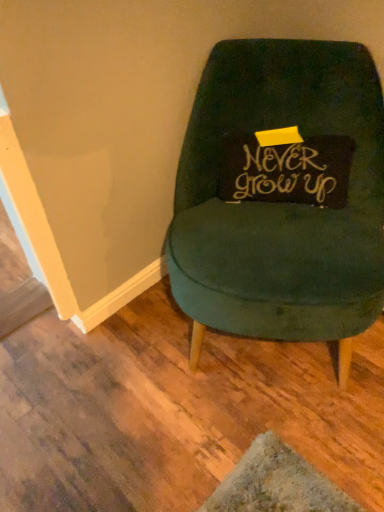
You are a GUI agent. You are given a task and a screenshot of the screen. Output one action in this format:
    pyautogui.click(x=<x>, y=<y>)
    Task: Click on the gold calligraphy pillow at center
    
    Given the screenshot: What is the action you would take?
    pyautogui.click(x=285, y=170)

The width and height of the screenshot is (384, 512). Describe the element at coordinates (285, 170) in the screenshot. I see `gold calligraphy pillow at center` at that location.

Image resolution: width=384 pixels, height=512 pixels. What do you see at coordinates (282, 195) in the screenshot? I see `velvet green chair at center` at bounding box center [282, 195].

Where is `velvet green chair at center`? Image resolution: width=384 pixels, height=512 pixels. velvet green chair at center is located at coordinates (282, 195).

Find the location of a particular element. This screenshot has width=384, height=512. gold calligraphy pillow at center is located at coordinates (285, 170).

Can you confirm if gold calligraphy pillow at center is positioned to the right of velvet green chair at center?

Correct, you'll find gold calligraphy pillow at center to the right of velvet green chair at center.

Does gold calligraphy pillow at center come behind velvet green chair at center?

Yes, gold calligraphy pillow at center is further from the camera.

Which is closer to the camera, (250, 176) or (359, 278)?

Point (250, 176) is positioned farther from the camera compared to point (359, 278).

From the image's perspective, which is above, gold calligraphy pillow at center or velvet green chair at center?

gold calligraphy pillow at center appears higher in the image.

From a real-world perspective, is gold calligraphy pillow at center physically located above or below velvet green chair at center?

gold calligraphy pillow at center is situated higher than velvet green chair at center in the real world.

Which of these two, gold calligraphy pillow at center or velvet green chair at center, is wider?

Wider between the two is velvet green chair at center.

Which of these two, gold calligraphy pillow at center or velvet green chair at center, stands taller?

velvet green chair at center is taller.

Looking at the image, does gold calligraphy pillow at center seem bigger or smaller compared to velvet green chair at center?

In the image, gold calligraphy pillow at center appears to be smaller than velvet green chair at center.

Is velvet green chair at center completely or partially inside gold calligraphy pillow at center?

No, velvet green chair at center is not a part of gold calligraphy pillow at center.

Is gold calligraphy pillow at center with velvet green chair at center?

gold calligraphy pillow at center is not next to velvet green chair at center, and they're not touching.

Is gold calligraphy pillow at center oriented away from velvet green chair at center?

That's right, gold calligraphy pillow at center is facing away from velvet green chair at center.

I want to click on chair in front of the gold calligraphy pillow at center, so click(282, 195).

Is velvet green chair at center at the left side of gold calligraphy pillow at center?

Yes.

Considering their positions, is velvet green chair at center located in front of or behind gold calligraphy pillow at center?

velvet green chair at center is in front of gold calligraphy pillow at center.

Considering the points (250, 284) and (339, 137), which point is behind, point (250, 284) or point (339, 137)?

Positioned behind is point (339, 137).

In the scene shown: From the image's perspective, between velvet green chair at center and gold calligraphy pillow at center, who is located below?

velvet green chair at center appears lower in the image.

From a real-world perspective, is velvet green chair at center below gold calligraphy pillow at center?

Yes, from a real-world perspective, velvet green chair at center is under gold calligraphy pillow at center.

Consider the image. Which object is wider, velvet green chair at center or gold calligraphy pillow at center?

Wider between the two is velvet green chair at center.

Is velvet green chair at center shorter than gold calligraphy pillow at center?

No, velvet green chair at center is not shorter than gold calligraphy pillow at center.

Who is bigger, velvet green chair at center or gold calligraphy pillow at center?

Bigger between the two is velvet green chair at center.

Which is correct: velvet green chair at center is inside gold calligraphy pillow at center, or outside of it?

velvet green chair at center cannot be found inside gold calligraphy pillow at center.

Are velvet green chair at center and gold calligraphy pillow at center making contact?

There is a gap between velvet green chair at center and gold calligraphy pillow at center.

Could you tell me if velvet green chair at center is facing gold calligraphy pillow at center?

Yes, velvet green chair at center is turned towards gold calligraphy pillow at center.

Find the location of a particular element. The height and width of the screenshot is (512, 384). chair in front of the gold calligraphy pillow at center is located at coordinates (282, 195).

This screenshot has height=512, width=384. What are the coordinates of `writing above the velvet green chair at center (from a real-world perspective)` in the screenshot? It's located at (285, 170).

In the image, there is a gold calligraphy pillow at center. Identify the location of chair below it (from the image's perspective). (282, 195).